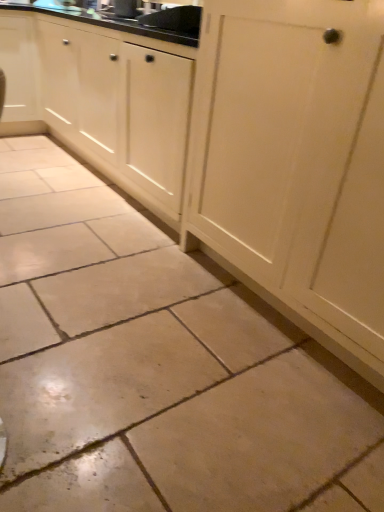
Question: From a real-world perspective, is white wood cabinet at center, the second cabinetry when ordered from left to right, located beneath matte black sink at upper center?

Choices:
 (A) no
 (B) yes

Answer: (B)

Question: Is white wood cabinet at center, the second cabinetry when ordered from left to right, not within matte black sink at upper center?

Choices:
 (A) yes
 (B) no

Answer: (A)

Question: Does white wood cabinet at center, which is the first cabinetry in right-to-left order, turn towards matte black sink at upper center?

Choices:
 (A) no
 (B) yes

Answer: (A)

Question: Is white wood cabinet at center, which is the first cabinetry in right-to-left order, taller than matte black sink at upper center?

Choices:
 (A) yes
 (B) no

Answer: (A)

Question: Can you confirm if white wood cabinet at center, the second cabinetry when ordered from left to right, is wider than matte black sink at upper center?

Choices:
 (A) no
 (B) yes

Answer: (B)

Question: Is white wood cabinet at center, the second cabinetry when ordered from left to right, smaller than matte black sink at upper center?

Choices:
 (A) no
 (B) yes

Answer: (A)

Question: Is matte black sink at upper center looking in the opposite direction of white wood cabinet at center, the second cabinetry when ordered from left to right?

Choices:
 (A) yes
 (B) no

Answer: (A)

Question: Is matte black sink at upper center oriented towards white wood cabinet at center, which is the first cabinetry in right-to-left order?

Choices:
 (A) yes
 (B) no

Answer: (A)

Question: Does matte black sink at upper center have a smaller size compared to white wood cabinet at center, which is the first cabinetry in right-to-left order?

Choices:
 (A) no
 (B) yes

Answer: (B)

Question: Considering the relative positions of matte black sink at upper center and white wood cabinet at center, the second cabinetry when ordered from left to right, in the image provided, is matte black sink at upper center to the left of white wood cabinet at center, the second cabinetry when ordered from left to right, from the viewer's perspective?

Choices:
 (A) no
 (B) yes

Answer: (B)

Question: From the image's perspective, is matte black sink at upper center over white wood cabinet at center, the second cabinetry when ordered from left to right?

Choices:
 (A) yes
 (B) no

Answer: (A)

Question: Can you confirm if matte black sink at upper center is taller than white wood cabinet at center, the second cabinetry when ordered from left to right?

Choices:
 (A) yes
 (B) no

Answer: (B)

Question: Is matte white cabinet at upper left, arranged as the 2th cabinetry when viewed from the right, far from matte black sink at upper center?

Choices:
 (A) yes
 (B) no

Answer: (B)